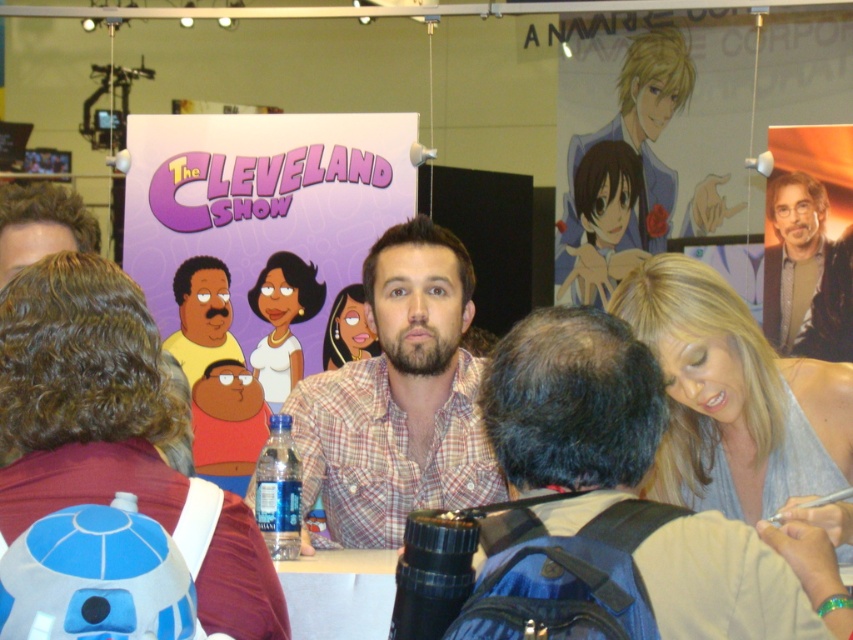
Looking at this image, you are an event planner looking at the convention layout. You need to place a new banner above the purple paper poster at center. Where should you position the shiny silver hair at upper right relative to the new banner?

The purple paper poster at center is located below shiny silver hair at upper right, so the shiny silver hair at upper right should be positioned above the new banner placed above the purple paper poster at center.